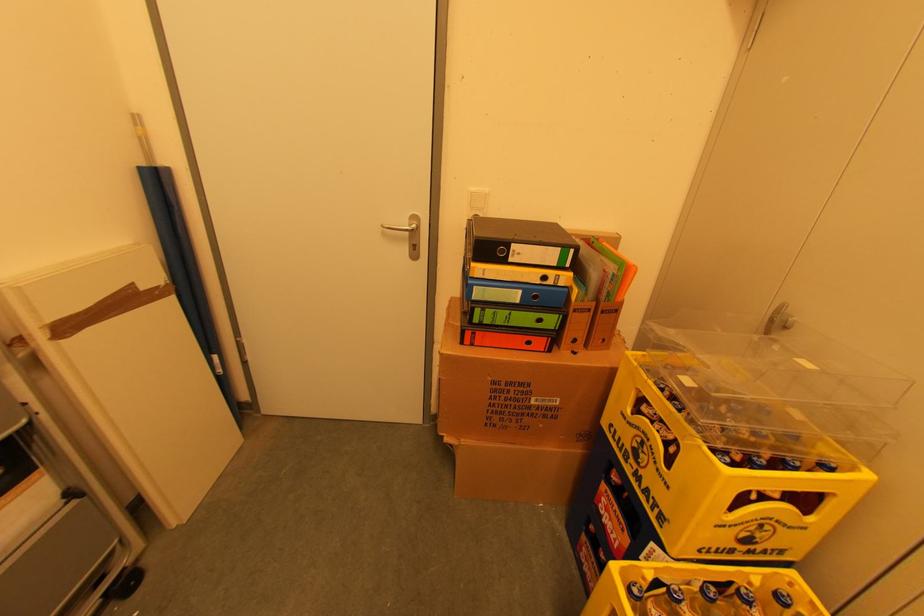
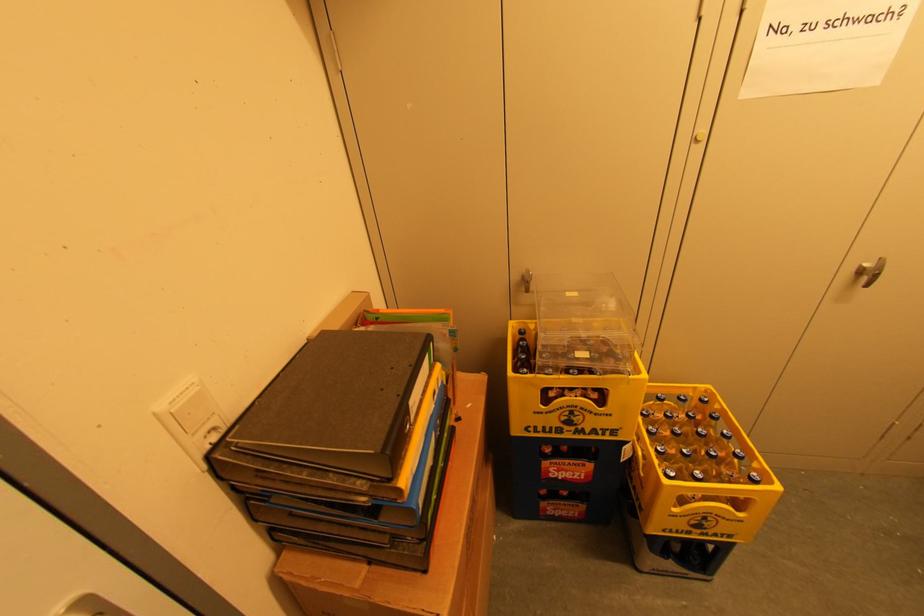
Where in the second image is the point corresponding to (645,456) from the first image?

(578, 419)